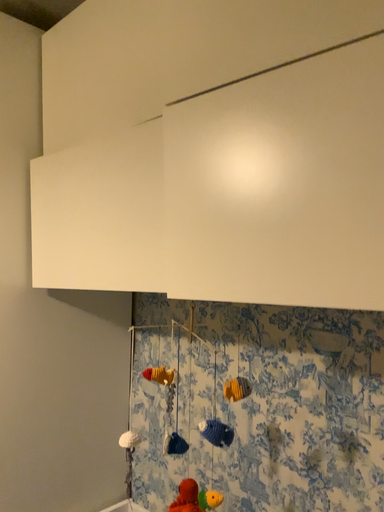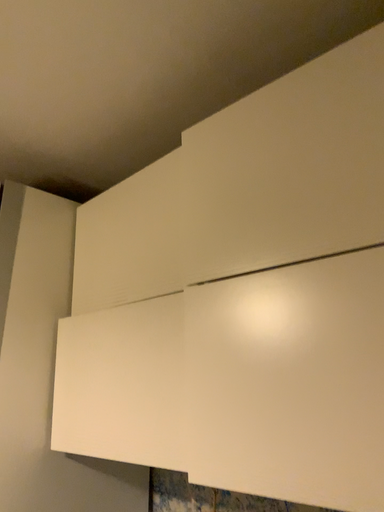
Question: How did the camera likely rotate when shooting the video?

Choices:
 (A) rotated downward
 (B) rotated upward

Answer: (B)